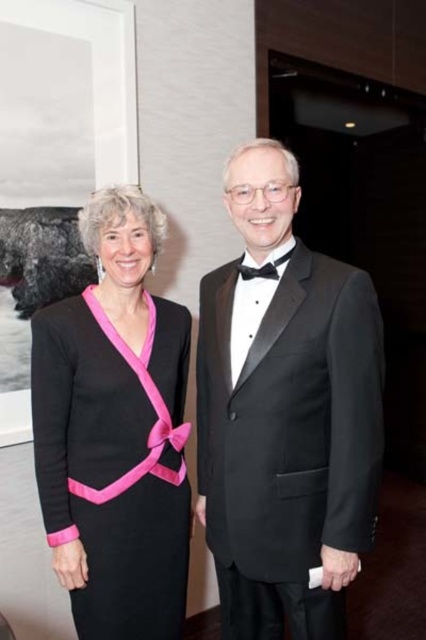
You are at a formal event and want to take a photo of both the point at coordinates point (111, 627) and the point at coordinates point (268, 275). Which point is closer to you?

Point (111, 627) is further to the viewer than point (268, 275), so the point at coordinates point (268, 275) is closer to you.

You are a photographer at a formal event. You need to position two people so that they are exactly 6 feet apart for a group photo. The woman in the black outfit with a pink ribbon is on the left and the man in the black tuxedo is on the right. Can you confirm if their current positions at point [198,333] meet the requirement?

The distance between the woman in the black outfit with a pink ribbon and the man in the black tuxedo is exactly 6.00 feet, so their current positions at point [198,333] meet the requirement.